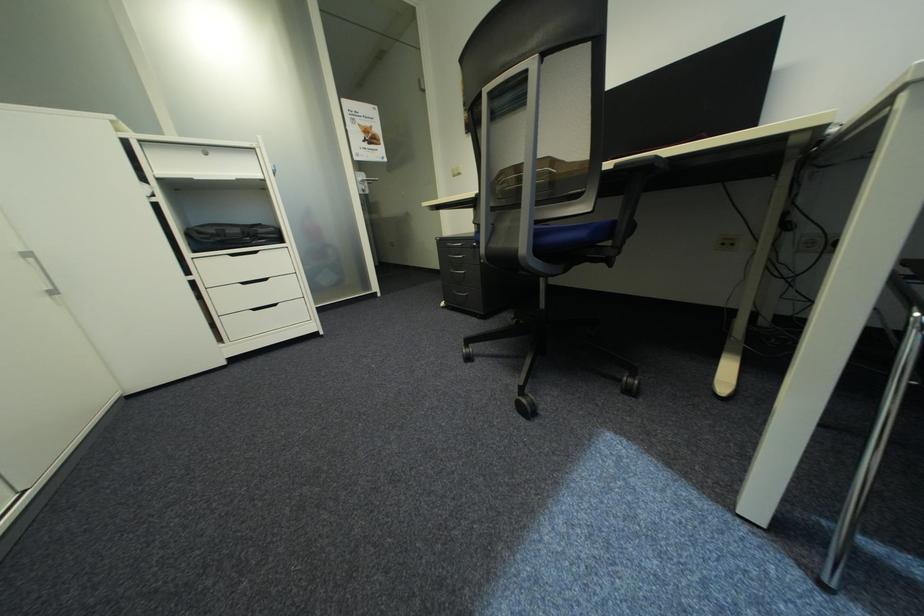
Describe the element at coordinates (362, 179) in the screenshot. I see `the metal door handle` at that location.